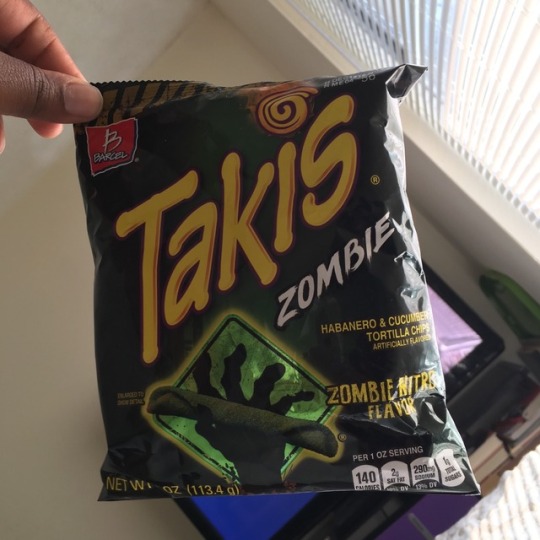
Locate an element on the screen. The height and width of the screenshot is (540, 540). blinds is located at coordinates (519, 141).